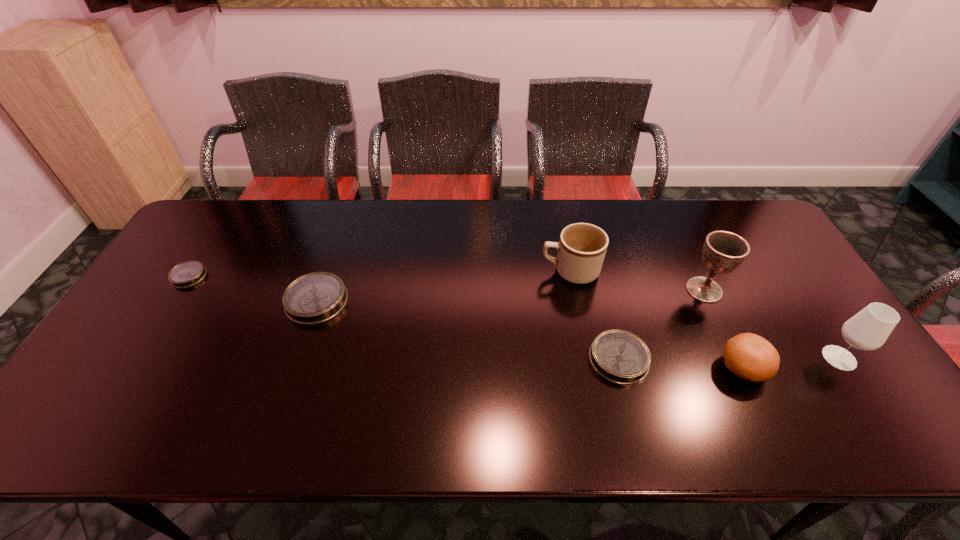
The height and width of the screenshot is (540, 960). What are the coordinates of `unoccupied area between the chalice and the clementine` in the screenshot? It's located at (723, 329).

Where is `free space between the mug and the glass`? This screenshot has height=540, width=960. free space between the mug and the glass is located at coordinates (705, 314).

At what (x,y) coordinates should I click in order to perform the action: click on unoccupied position between the fourth shortest object and the leftmost compass. Please return your answer as a coordinate pair (x, y). Looking at the image, I should click on (466, 322).

Locate an element on the screen. free spot between the shortest compass and the nearest compass is located at coordinates (404, 318).

This screenshot has width=960, height=540. Find the location of `vacant point located between the third tallest object and the clementine`. vacant point located between the third tallest object and the clementine is located at coordinates (657, 320).

At what (x,y) coordinates should I click in order to perform the action: click on unoccupied area between the clementine and the third tallest object. Please return your answer as a coordinate pair (x, y). Looking at the image, I should click on (657, 320).

The height and width of the screenshot is (540, 960). I want to click on unoccupied area between the clementine and the second compass from right to left, so click(x=530, y=334).

At what (x,y) coordinates should I click in order to perform the action: click on vacant area that lies between the chalice and the fourth shortest object. Please return your answer as a coordinate pair (x, y). The width and height of the screenshot is (960, 540). Looking at the image, I should click on (723, 329).

This screenshot has height=540, width=960. I want to click on free space that is in between the leftmost object and the glass, so click(514, 317).

The height and width of the screenshot is (540, 960). Find the location of `vacant space in between the glass and the chalice`. vacant space in between the glass and the chalice is located at coordinates 772,324.